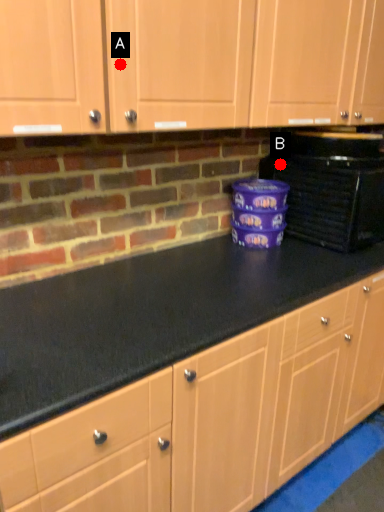
Question: Two points are circled on the image, labeled by A and B beside each circle. Among these points, which one is farthest from the camera?

Choices:
 (A) A is further
 (B) B is further

Answer: (B)